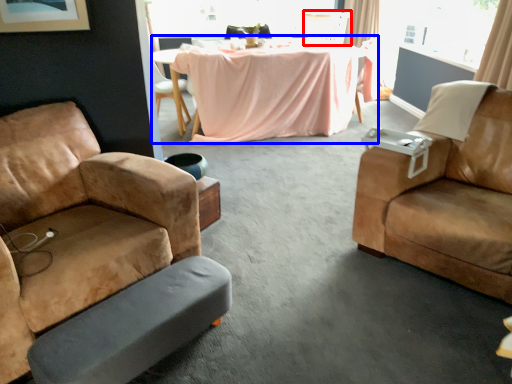
Question: Which object appears farthest to the camera in this image, armchair (highlighted by a red box) or table (highlighted by a blue box)?

Choices:
 (A) armchair
 (B) table

Answer: (A)